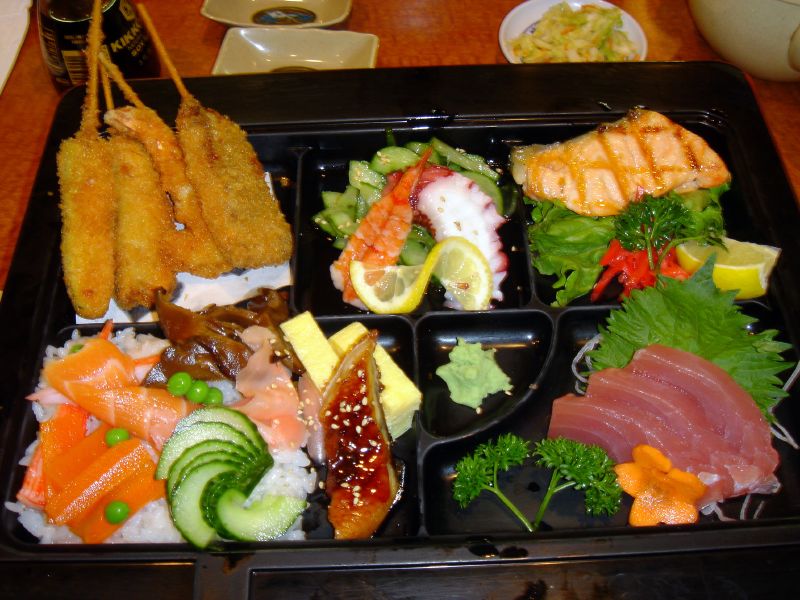
At what (x,y) coordinates should I click in order to perform the action: click on food tray. Please return your answer as a coordinate pair (x, y). Image resolution: width=800 pixels, height=600 pixels. Looking at the image, I should click on (533, 338).